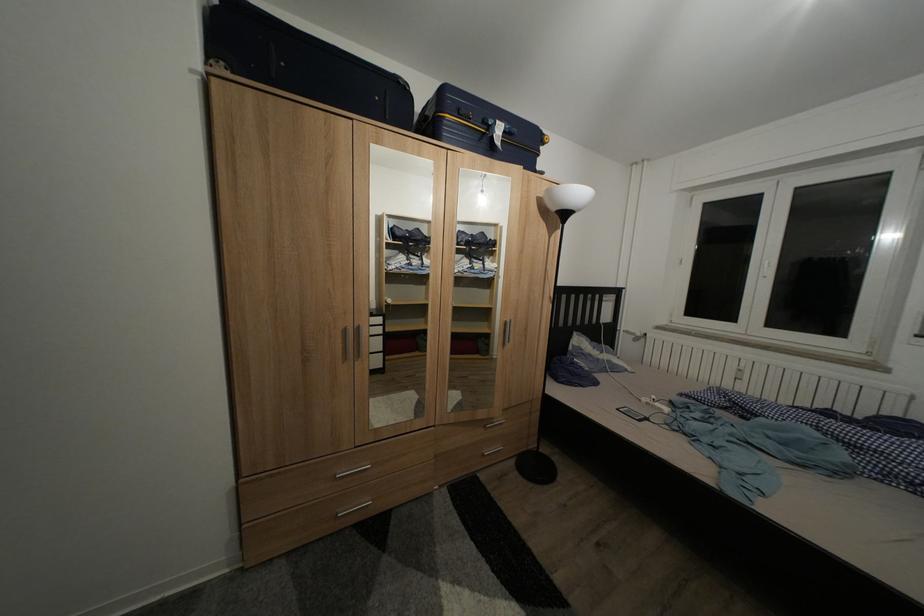
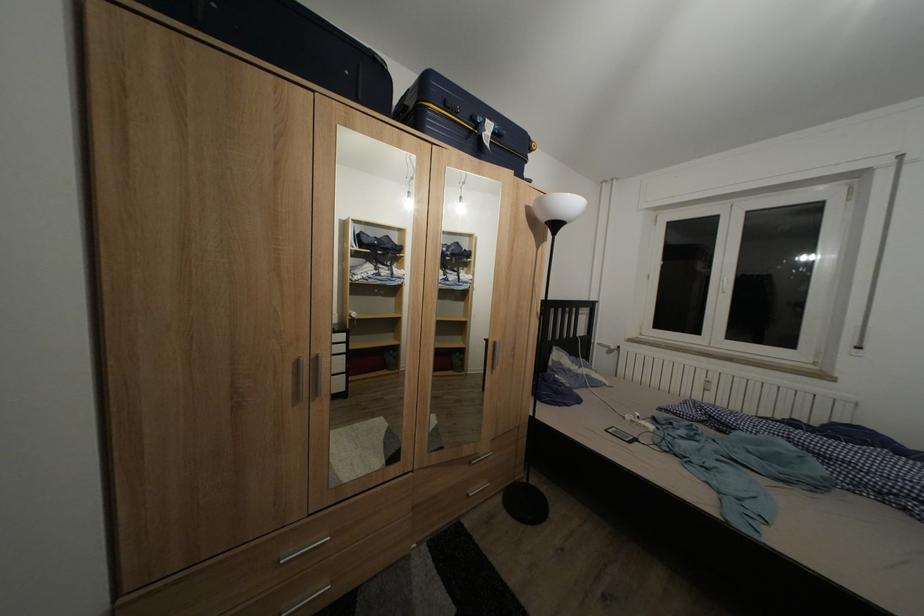
What movement of the cameraman would produce the second image?

The movement direction of the cameraman is left, forward.